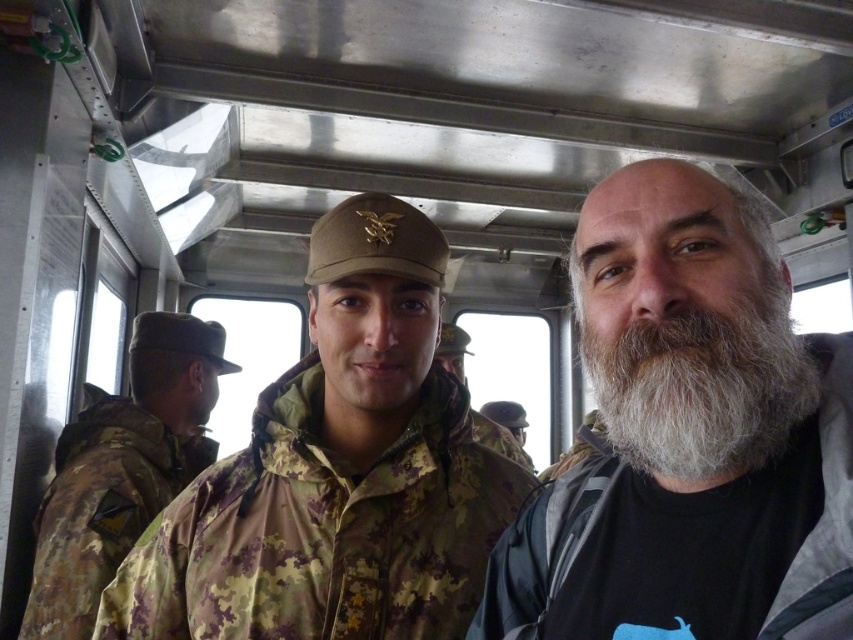
Between white beard at center and camouflage uniform at left, which one appears on the right side from the viewer's perspective?

From the viewer's perspective, white beard at center appears more on the right side.

Describe the element at coordinates (688, 436) in the screenshot. I see `white beard at center` at that location.

Is point (712, 532) positioned after point (57, 602)?

No, (712, 532) is closer to viewer.

The width and height of the screenshot is (853, 640). What are the coordinates of `white beard at center` in the screenshot? It's located at pyautogui.click(x=688, y=436).

Can you confirm if white fuzzy beard at center is smaller than camouflage fabric uniform at center?

Yes, white fuzzy beard at center is smaller than camouflage fabric uniform at center.

Who is positioned more to the right, white fuzzy beard at center or camouflage fabric uniform at center?

From the viewer's perspective, camouflage fabric uniform at center appears more on the right side.

The image size is (853, 640). In order to click on white fuzzy beard at center in this screenshot , I will do `click(703, 387)`.

Between camouflage fabric jacket at center and white fuzzy beard at center, which one appears on the left side from the viewer's perspective?

Positioned to the left is camouflage fabric jacket at center.

Between camouflage fabric jacket at center and white fuzzy beard at center, which one appears on the right side from the viewer's perspective?

white fuzzy beard at center is more to the right.

Between point (218, 461) and point (697, 440), which one is positioned in front?

Point (697, 440)

Locate an element on the screen. This screenshot has height=640, width=853. camouflage fabric jacket at center is located at coordinates (337, 472).